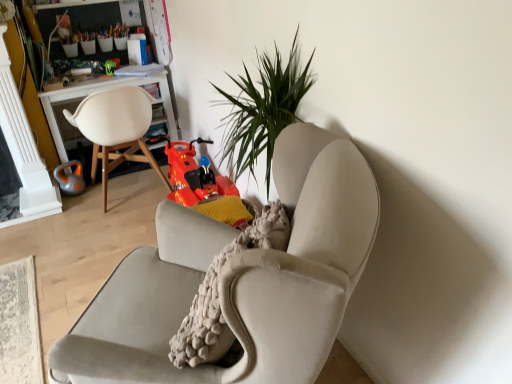
What are the coordinates of `free space in front of orange rubber kettlebell at left, marked as the second toy in a right-to-left arrangement` in the screenshot? It's located at (79, 202).